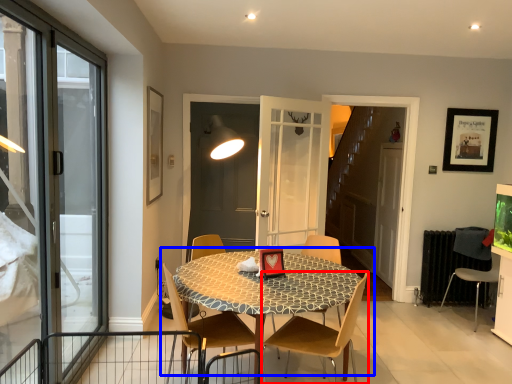
Question: Which point is further to the camera, chair (highlighted by a red box) or kitchen & dining room table (highlighted by a blue box)?

Choices:
 (A) chair
 (B) kitchen & dining room table

Answer: (B)